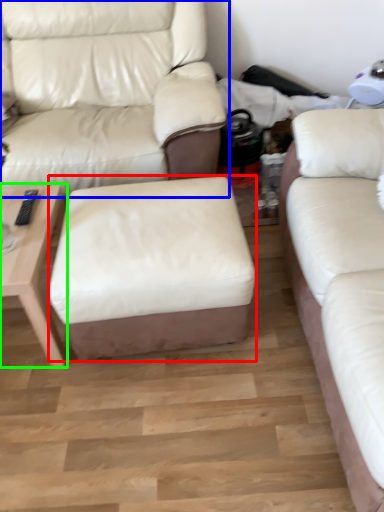
Question: Estimate the real-world distances between objects in this image. Which object is closer to stool (highlighted by a red box), studio couch (highlighted by a blue box) or table (highlighted by a green box)?

Choices:
 (A) studio couch
 (B) table

Answer: (B)